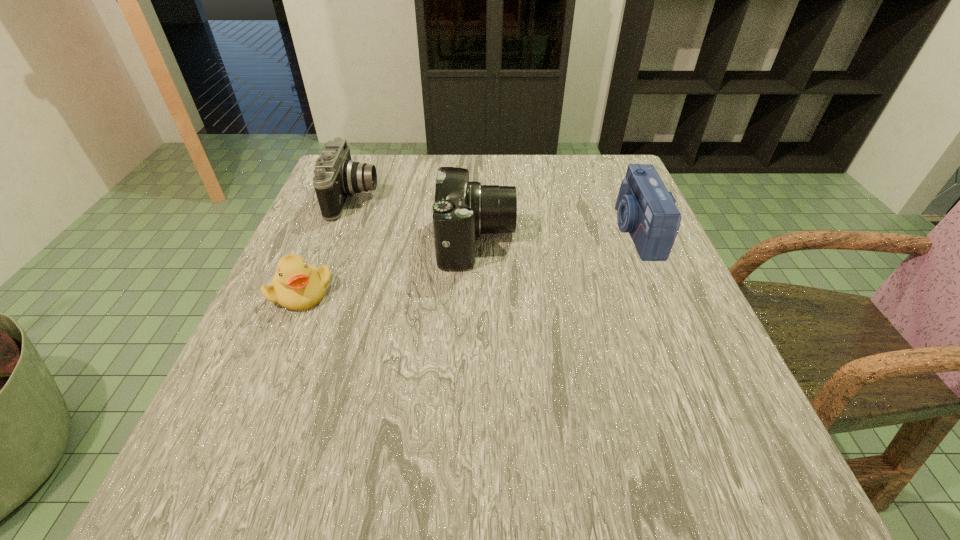
Locate which camera is the closest to the third object from left to right. Please provide its 2D coordinates. Your answer should be formatted as a tuple, i.e. [(x, y)], where the tuple contains the x and y coordinates of a point satisfying the conditions above.

[(336, 177)]

The image size is (960, 540). Find the location of `blank area in the image that satisfies the following two spatial constraints: 1. on the lens of the rightmost object; 2. on the beak of the duckling`. blank area in the image that satisfies the following two spatial constraints: 1. on the lens of the rightmost object; 2. on the beak of the duckling is located at coordinates pos(662,292).

Find the location of a particular element. vacant space that satisfies the following two spatial constraints: 1. on the lens of the third object from left to right; 2. on the beak of the shortest object is located at coordinates (476, 292).